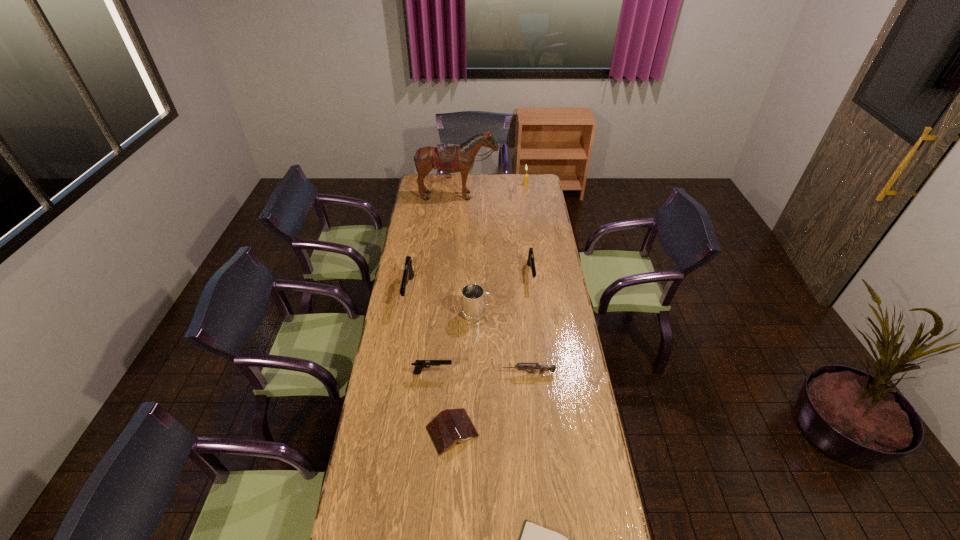
This screenshot has width=960, height=540. I want to click on free space that is in between the saddle and the gray mug, so click(x=468, y=255).

Find the location of `unoccupied area between the second smallest black gun and the eighth tallest object`. unoccupied area between the second smallest black gun and the eighth tallest object is located at coordinates (492, 353).

Find the location of a particular element. vacant area that lies between the brown book and the shortest gun is located at coordinates (491, 402).

Where is `object that is the eighth closest to the fourth shortest object`? object that is the eighth closest to the fourth shortest object is located at coordinates (525, 183).

Identify which object is the sixth closest to the grey gun. Please provide its 2D coordinates. Your answer should be formatted as a tuple, i.e. [(x, y)], where the tuple contains the x and y coordinates of a point satisfying the conditions above.

[(534, 539)]

Identify the location of gun that is the nearest to the second shortest gun. (542, 368).

Select which gun is the closest to the gray mug. Please provide its 2D coordinates. Your answer should be formatted as a tuple, i.e. [(x, y)], where the tuple contains the x and y coordinates of a point satisfying the conditions above.

[(531, 263)]

Select which black gun is the closest to the shortest gun. Please provide its 2D coordinates. Your answer should be formatted as a tuple, i.e. [(x, y)], where the tuple contains the x and y coordinates of a point satisfying the conditions above.

[(419, 364)]

Find the location of a particular element. The width and height of the screenshot is (960, 540). black gun that stands as the closest to the nearest black gun is located at coordinates (408, 273).